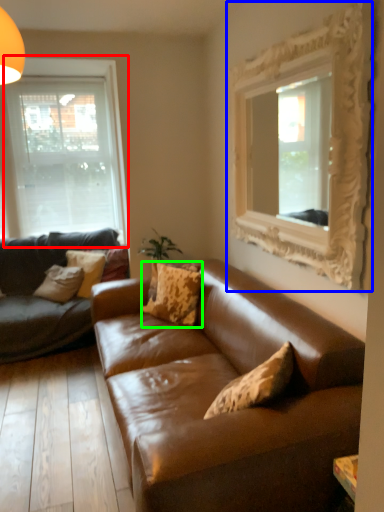
Question: Which object is the closest to the window (highlighted by a red box)? Choose among these: picture frame (highlighted by a blue box) or pillow (highlighted by a green box).

Choices:
 (A) picture frame
 (B) pillow

Answer: (B)